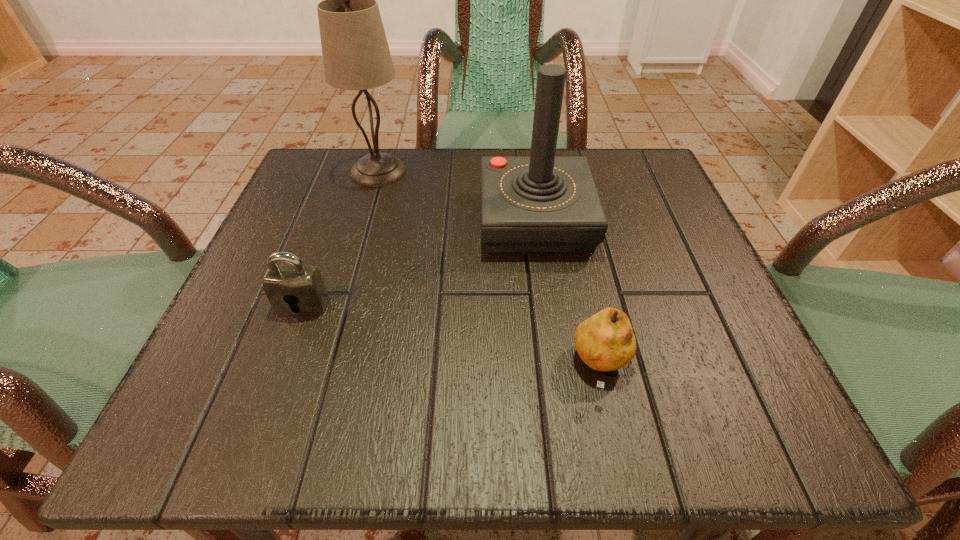
Find the location of a particular element. free space in the image that satisfies the following two spatial constraints: 1. at the front of the nearest object near the keyhole; 2. on the left side of the padlock is located at coordinates (279, 368).

You are a GUI agent. You are given a task and a screenshot of the screen. Output one action in this format:
    pyautogui.click(x=<x>, y=<y>)
    Task: Click on the vacant area that satisfies the following two spatial constraints: 1. at the front of the nearest object near the keyhole; 2. on the left side of the padlock
    
    Given the screenshot: What is the action you would take?
    pyautogui.click(x=279, y=368)

This screenshot has width=960, height=540. In order to click on blank space that satisfies the following two spatial constraints: 1. at the front of the second nearest object near the keyhole; 2. on the right side of the pear in this screenshot , I will do `click(279, 368)`.

Image resolution: width=960 pixels, height=540 pixels. I want to click on free spot that satisfies the following two spatial constraints: 1. on the front-facing side of the farthest object; 2. at the front of the second nearest object near the keyhole, so click(340, 305).